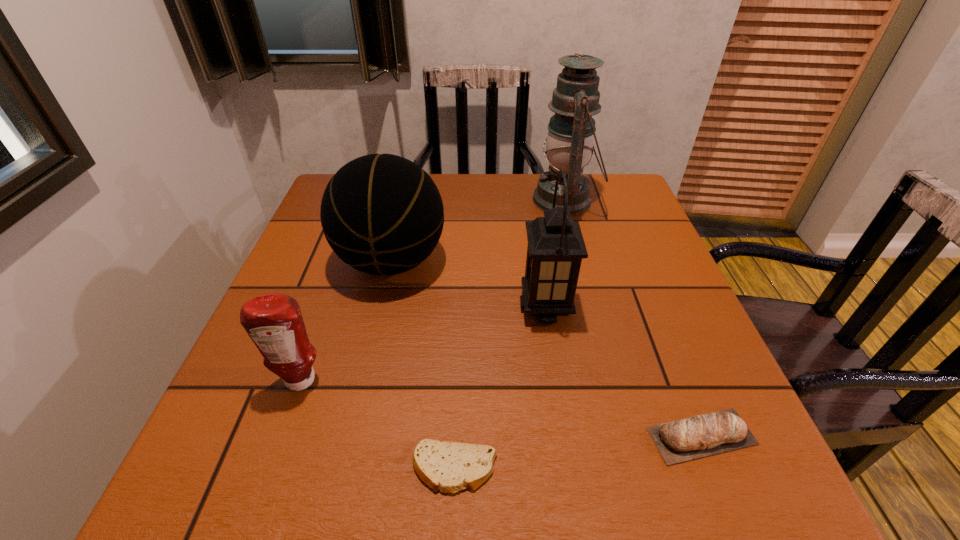
This screenshot has width=960, height=540. I want to click on pita bread situated at the right edge, so click(703, 435).

I want to click on object present at the far right corner, so click(571, 131).

In order to click on object present at the near right corner in this screenshot , I will do `click(703, 435)`.

You are a GUI agent. You are given a task and a screenshot of the screen. Output one action in this format:
    pyautogui.click(x=<x>, y=<y>)
    Task: Click on the free region at the far edge of the desktop
    The width and height of the screenshot is (960, 540).
    Given the screenshot: What is the action you would take?
    pyautogui.click(x=469, y=181)

Locate an element on the screen. vacant region at the near edge of the desktop is located at coordinates (602, 502).

In the image, there is a desktop. Where is `vacant space at the left edge`? Image resolution: width=960 pixels, height=540 pixels. vacant space at the left edge is located at coordinates tap(228, 410).

Where is `vacant space at the right edge of the desktop`? This screenshot has height=540, width=960. vacant space at the right edge of the desktop is located at coordinates (657, 269).

You are a GUI agent. You are given a task and a screenshot of the screen. Output one action in this format:
    pyautogui.click(x=<x>, y=<y>)
    Task: Click on the vacant position at the far right corner of the desktop
    The width and height of the screenshot is (960, 540).
    Given the screenshot: What is the action you would take?
    pyautogui.click(x=594, y=197)

In order to click on vacant space that is in between the taller pita bread and the farthest object in this screenshot , I will do `click(634, 318)`.

This screenshot has height=540, width=960. Identify the location of free space between the oil lamp and the right pita bread. (634, 318).